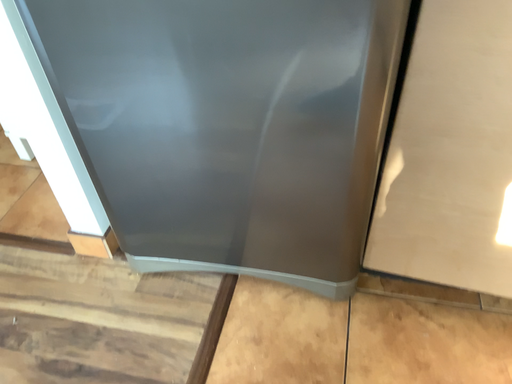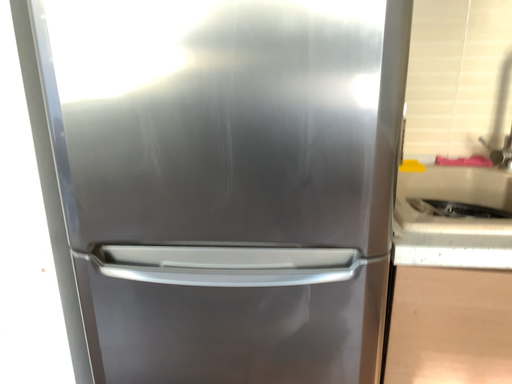
Question: How did the camera likely rotate when shooting the video?

Choices:
 (A) rotated downward
 (B) rotated upward

Answer: (B)